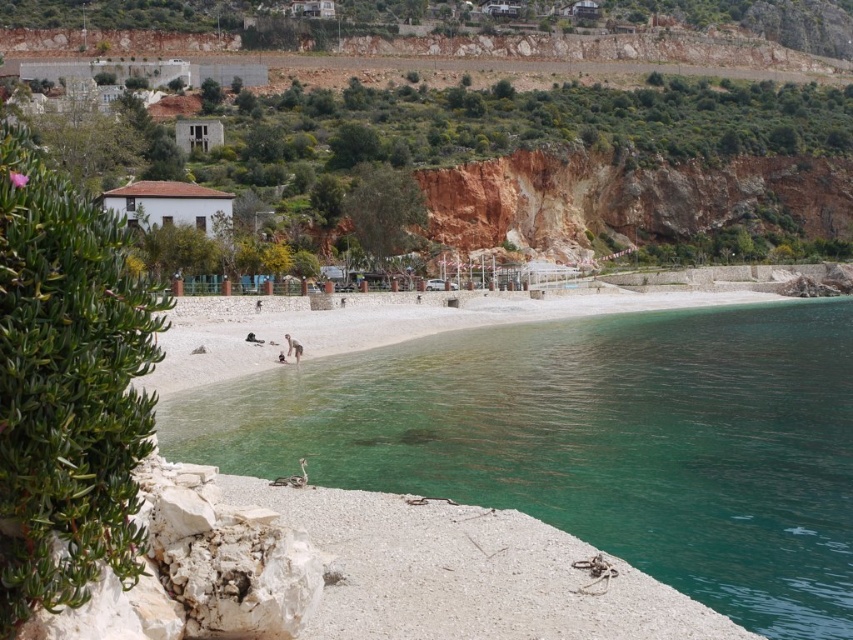
Question: Is green smooth water at center to the right of white fabric person at center from the viewer's perspective?

Choices:
 (A) yes
 (B) no

Answer: (A)

Question: Which of the following is the farthest from the observer?

Choices:
 (A) (300, 348)
 (B) (288, 324)
 (C) (335, 516)
 (D) (769, 525)

Answer: (B)

Question: Which of the following is the closest to the observer?

Choices:
 (A) click(593, 296)
 (B) click(264, 388)

Answer: (B)

Question: Is white gravel at lower left positioned behind white fabric person at center?

Choices:
 (A) no
 (B) yes

Answer: (A)

Question: Which of the following is the closest to the observer?

Choices:
 (A) (425, 332)
 (B) (289, 349)

Answer: (B)

Question: Can you confirm if green smooth water at center is positioned above white fabric person at center?

Choices:
 (A) yes
 (B) no

Answer: (B)